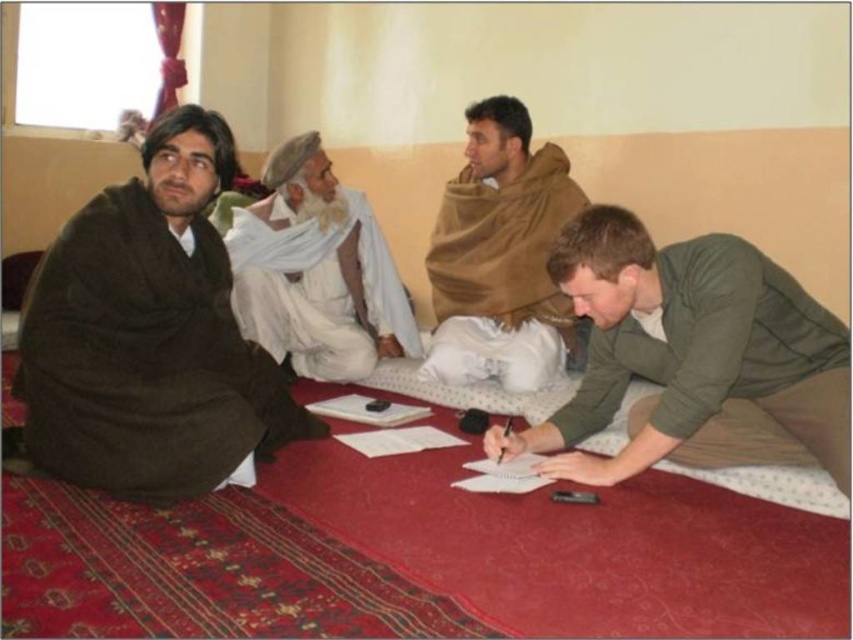
What are the coordinates of the brown woolen robe at left in the image?

The coordinates of the brown woolen robe at left are at point (144, 358).

You are standing in the room and want to take a photo of the green matte shirt at lower right using a camera. The camera has a minimum focusing distance of 5 feet. Can you take the photo without moving closer?

The green matte shirt at lower right and camera are 6.32 feet apart from each other. Since the minimum focusing distance is 5 feet, the camera can focus and take the photo without moving closer.